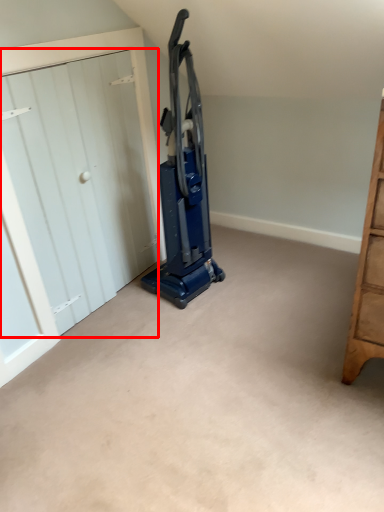
Question: Considering the relative positions of door (annotated by the red box) and equipment in the image provided, where is door (annotated by the red box) located with respect to the staircase?

Choices:
 (A) right
 (B) left

Answer: (B)